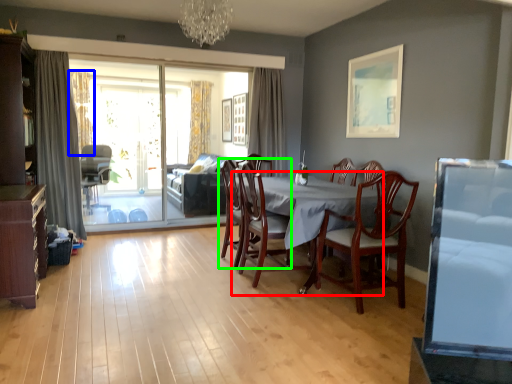
Question: Which object is positioned farthest from round table (highlighted by a red box)? Select from curtain (highlighted by a blue box) and chair (highlighted by a green box).

Choices:
 (A) curtain
 (B) chair

Answer: (A)